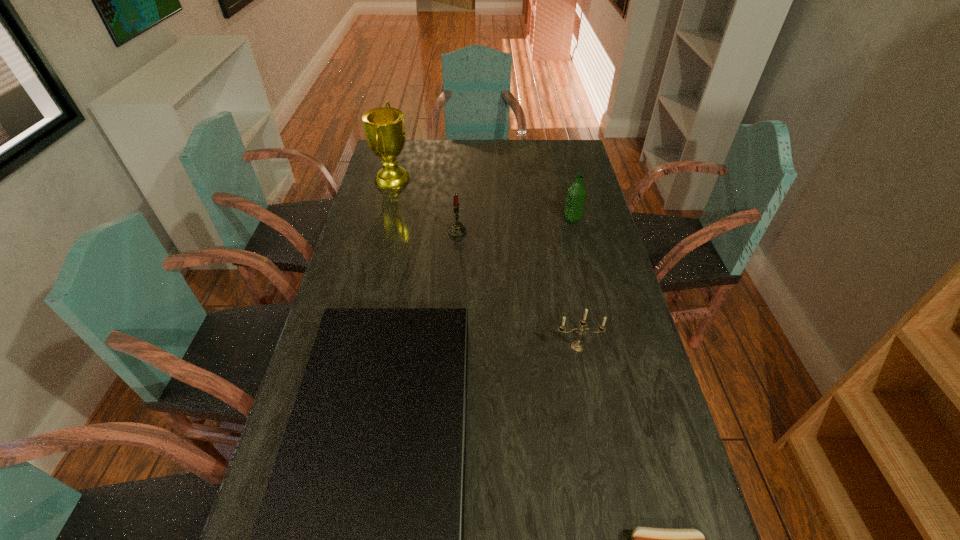
This screenshot has width=960, height=540. Identify the location of free spot between the right candle and the second farthest object. (575, 283).

This screenshot has width=960, height=540. I want to click on free space between the farther candle and the nearer candle, so click(517, 289).

I want to click on free space between the right candle and the farther candle, so click(x=517, y=289).

You are a GUI agent. You are given a task and a screenshot of the screen. Output one action in this format:
    pyautogui.click(x=<x>, y=<y>)
    Task: Click on the third closest object to the second farthest object
    The height and width of the screenshot is (540, 960).
    Given the screenshot: What is the action you would take?
    click(x=384, y=128)

This screenshot has width=960, height=540. In order to click on object that is the closest to the right candle in this screenshot , I will do `click(359, 539)`.

This screenshot has height=540, width=960. I want to click on free space that satisfies the following two spatial constraints: 1. on the front side of the right candle; 2. on the right side of the farther candle, so click(x=450, y=347).